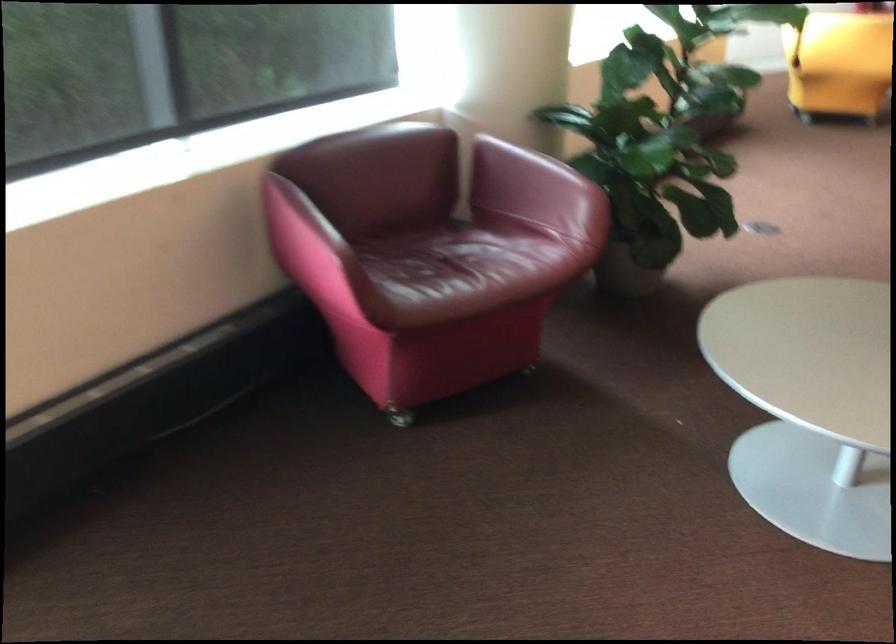
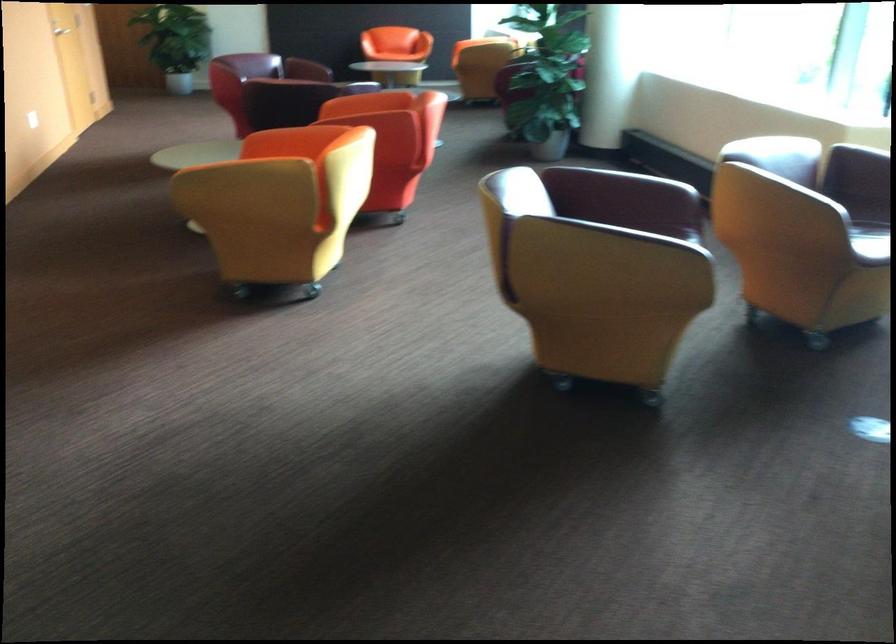
Question: I am providing you with two images of the same scene from different viewpoints. Which of the following objects are not visible in image2?

Choices:
 (A) red chair armrest
 (B) pink chair sitting surface
 (C) yellow chair armrest
 (D) metal coat hanger

Answer: (B)